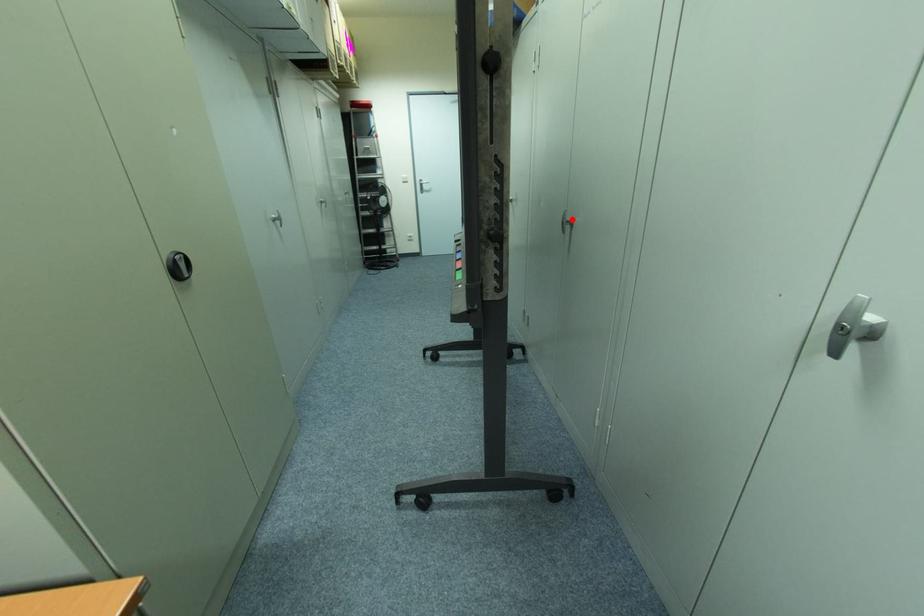
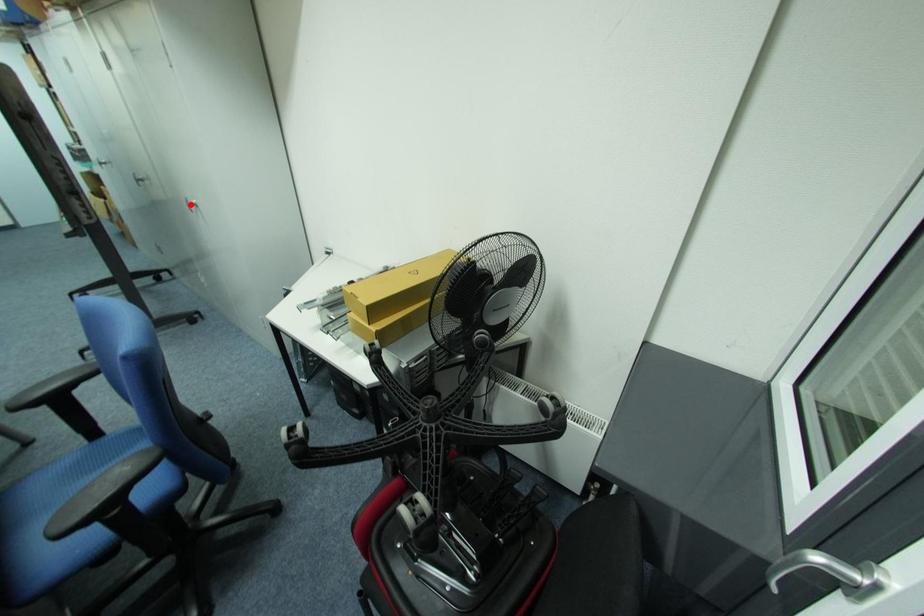
I am providing you with two images of the same scene from different viewpoints. A red point is marked on the first image and another point is marked on the second image. Is the marked point in image1 the same physical position as the marked point in image2?

No